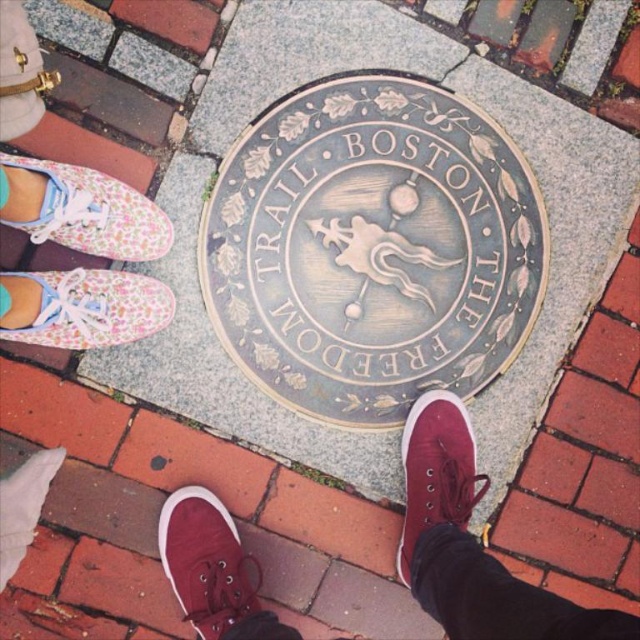
You are a delivery robot with a 12 inch wide package. You need to place the package between the bronze textured medallion at center and the floral fabric shoe at upper left. Can you fit the package between them without overlapping either object?

The distance between the bronze textured medallion at center and the floral fabric shoe at upper left is 15.81 inches. Since the package is 12 inches wide, there is enough space to place it between them without overlapping either object.

You are standing 2 meters away from the plaque and want to touch the bronze textured medallion at center. Can you reach it without moving your feet?

The bronze textured medallion at center is 1.53 meters away from the viewer. Since you are standing 2 meters away, you cannot reach it without moving closer.

You are a photographer positioned at the edge of the brick area. You want to capture both the bronze textured medallion at center and the floral fabric shoe at lower left in a single shot. Based on their positions, which object should you focus on first to ensure both are in frame?

The bronze textured medallion at center is above the floral fabric shoe at lower left, so you should focus on the bronze textured medallion at center first to ensure both are in frame.